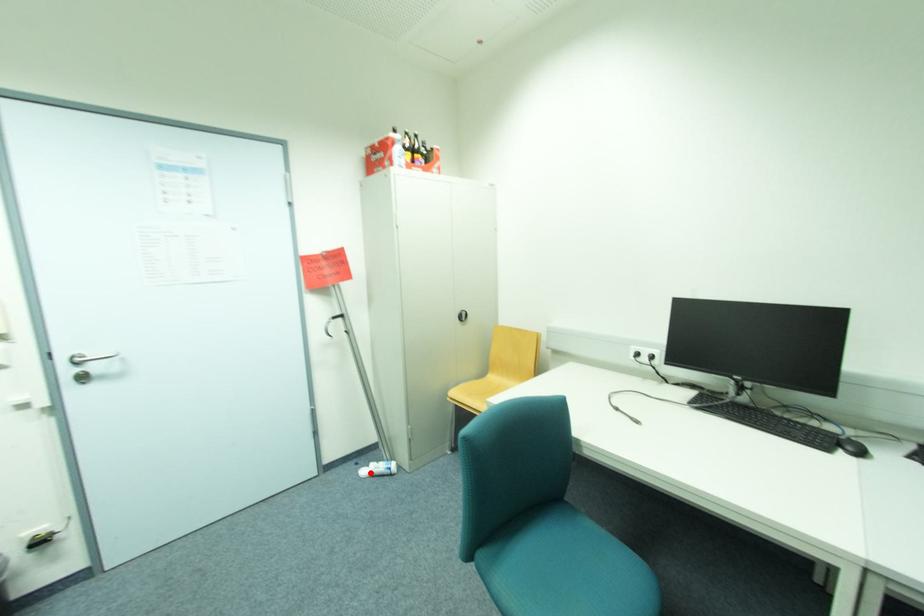
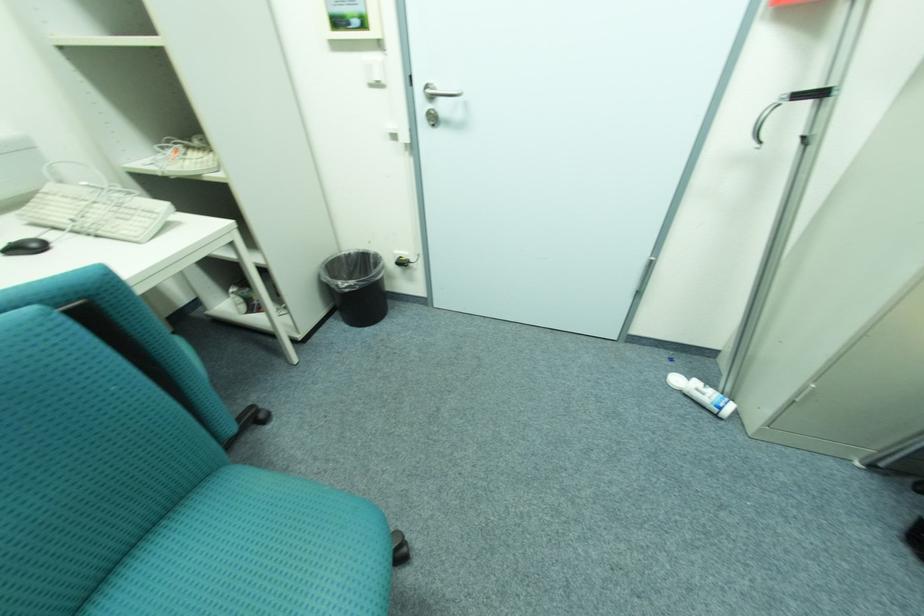
Question: I am providing you with two images of the same scene from different viewpoints. Given a red point in image1, look at the same physical point in image2. Is it:

Choices:
 (A) Closer to the viewpoint
 (B) Farther from the viewpoint

Answer: (A)